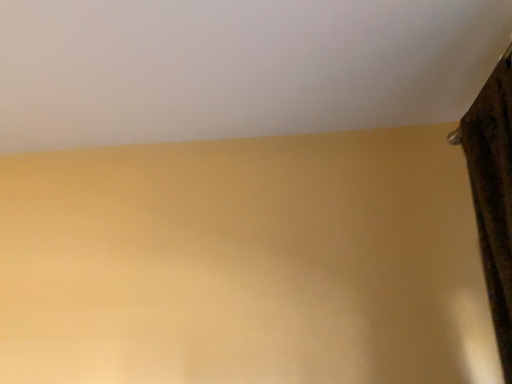
Question: Should I look upward or downward to see brown textured curtain at right?

Choices:
 (A) down
 (B) up

Answer: (A)